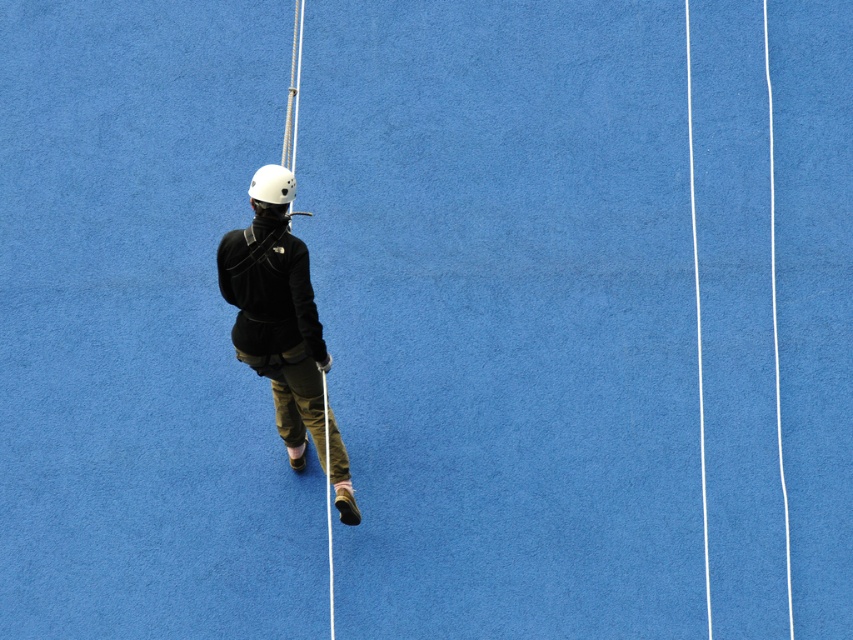
Is matte black jacket at center further to the viewer compared to white matte helmet at center?

Yes, it is.

Who is lower down, matte black jacket at center or white matte helmet at center?

matte black jacket at center is lower down.

Between point (299, 380) and point (268, 196), which one is positioned behind?

Positioned behind is point (299, 380).

In order to click on matte black jacket at center in this screenshot , I will do `click(276, 310)`.

Measure the distance between white matte helmet at center and camera.

27.19 feet

Locate an element on the screen. white matte helmet at center is located at coordinates (271, 184).

Is matte black jacket at center positioned in front of matte black ski pole at center?

Yes.

Does matte black jacket at center appear under matte black ski pole at center?

Incorrect, matte black jacket at center is not positioned below matte black ski pole at center.

Locate an element on the screen. This screenshot has width=853, height=640. matte black jacket at center is located at coordinates (276, 310).

Locate an element on the screen. This screenshot has width=853, height=640. matte black jacket at center is located at coordinates (276, 310).